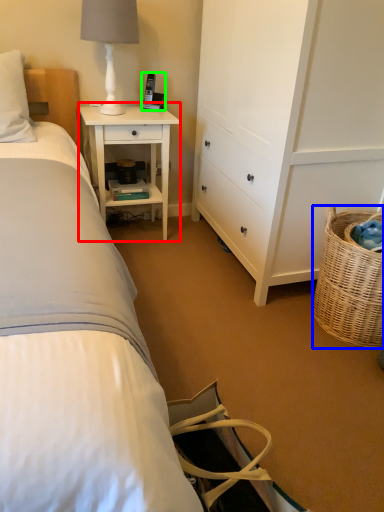
Question: Based on their relative distances, which object is nearer to nightstand (highlighted by a red box)? Choose from picnic basket (highlighted by a blue box) and corded phone (highlighted by a green box).

Choices:
 (A) picnic basket
 (B) corded phone

Answer: (B)